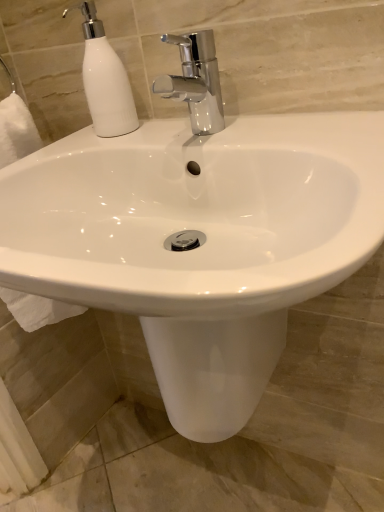
Question: Is white matte soap dispenser at upper left spatially inside chrome metallic faucet at upper center, or outside of it?

Choices:
 (A) inside
 (B) outside

Answer: (B)

Question: From a real-world perspective, relative to chrome metallic faucet at upper center, is white matte soap dispenser at upper left vertically above or below?

Choices:
 (A) above
 (B) below

Answer: (A)

Question: Is white matte soap dispenser at upper left in front of or behind chrome metallic faucet at upper center in the image?

Choices:
 (A) behind
 (B) front

Answer: (A)

Question: Is chrome metallic faucet at upper center situated inside white matte soap dispenser at upper left or outside?

Choices:
 (A) inside
 (B) outside

Answer: (B)

Question: Considering the positions of point (195, 82) and point (87, 102), is point (195, 82) closer or farther from the camera than point (87, 102)?

Choices:
 (A) farther
 (B) closer

Answer: (B)

Question: From the image's perspective, is chrome metallic faucet at upper center positioned above or below white matte soap dispenser at upper left?

Choices:
 (A) above
 (B) below

Answer: (B)

Question: Is chrome metallic faucet at upper center taller or shorter than white matte soap dispenser at upper left?

Choices:
 (A) short
 (B) tall

Answer: (A)